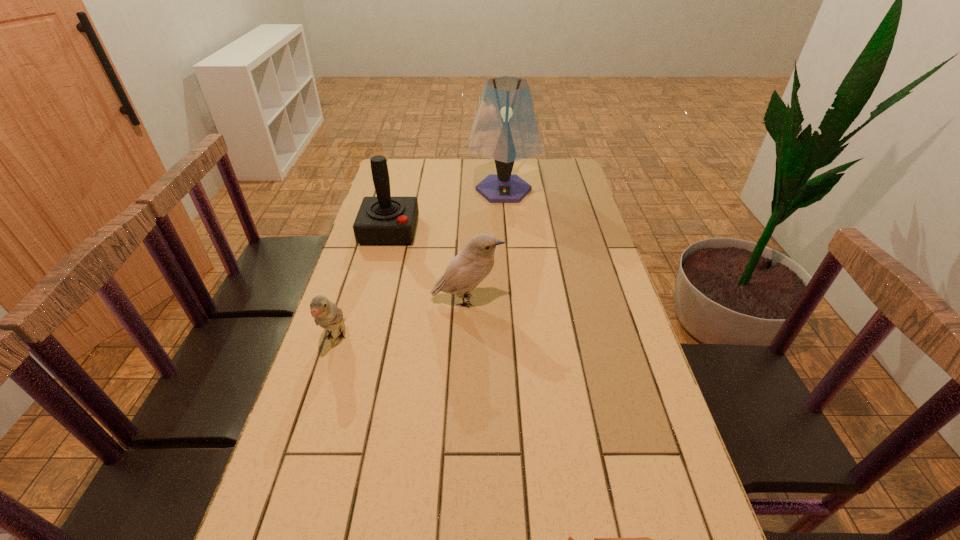
I want to click on free region located 0.180m at the face of the second tallest bird, so click(x=307, y=424).

The width and height of the screenshot is (960, 540). I want to click on object positioned at the far edge, so click(505, 129).

Where is `joystick positioned at the left edge`? This screenshot has height=540, width=960. joystick positioned at the left edge is located at coordinates coord(383,220).

Locate an element on the screen. bird that is at the left edge is located at coordinates (326, 314).

Where is `free space at the far edge of the desktop`? free space at the far edge of the desktop is located at coordinates (481, 171).

The height and width of the screenshot is (540, 960). In the image, there is a desktop. What are the coordinates of `blank space at the left edge` in the screenshot? It's located at (361, 344).

Locate an element on the screen. free space at the right edge of the desktop is located at coordinates (690, 509).

You are a GUI agent. You are given a task and a screenshot of the screen. Output one action in this format:
    pyautogui.click(x=<x>, y=<y>)
    Task: Click on the free location at the far left corner
    
    Given the screenshot: What is the action you would take?
    pyautogui.click(x=397, y=161)

The width and height of the screenshot is (960, 540). I want to click on unoccupied area between the second tallest bird and the tallest bird, so click(x=401, y=319).

Find the location of a particular element. This screenshot has width=960, height=540. free space between the second tallest bird and the farthest object is located at coordinates (420, 264).